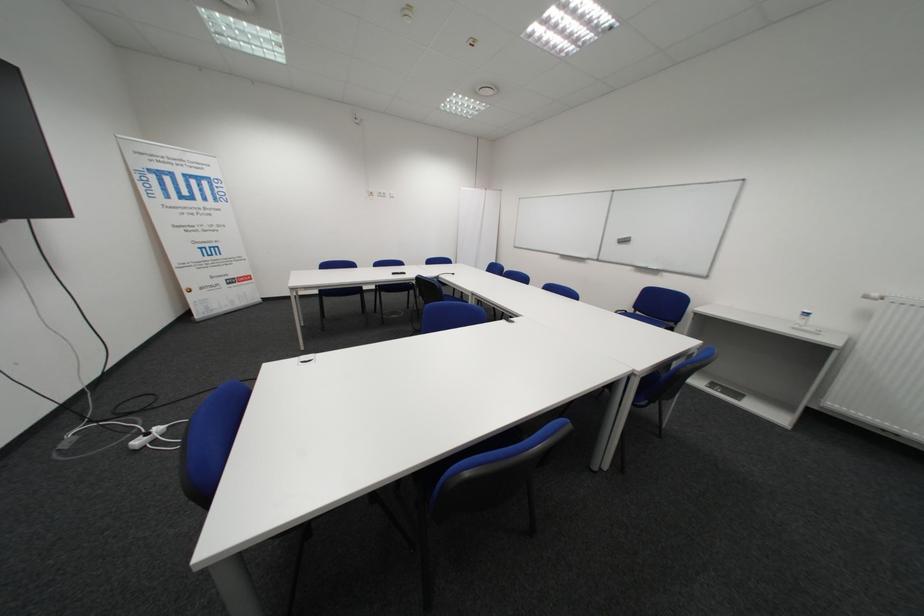
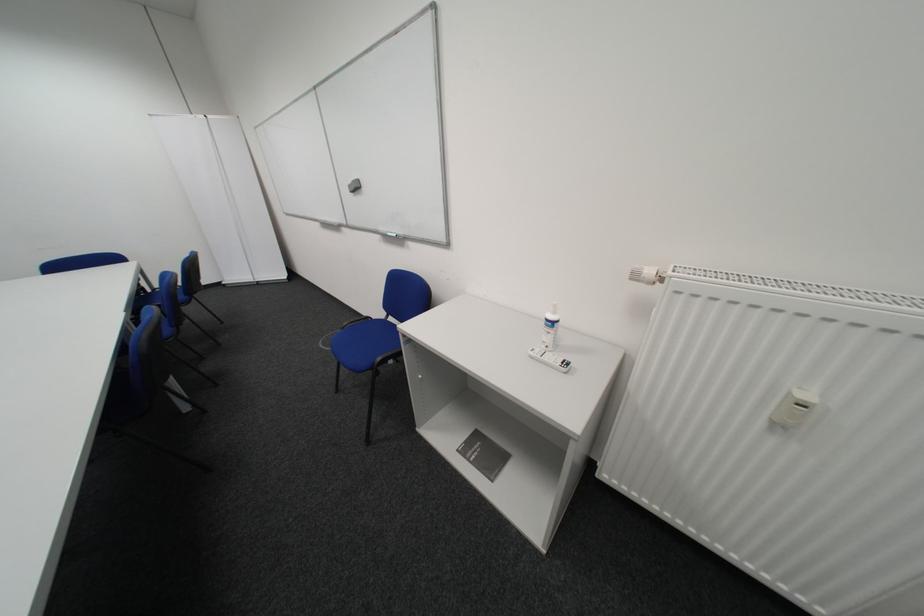
In a continuous first-person perspective shot, in which direction is the camera moving?

The movement direction of the cameraman is right, forward.